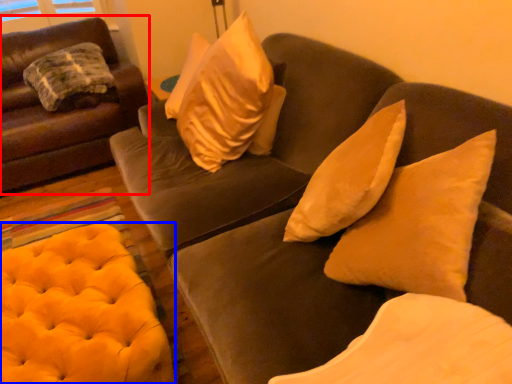
Question: Among these objects, which one is farthest to the camera, studio couch (highlighted by a red box) or stool (highlighted by a blue box)?

Choices:
 (A) studio couch
 (B) stool

Answer: (A)